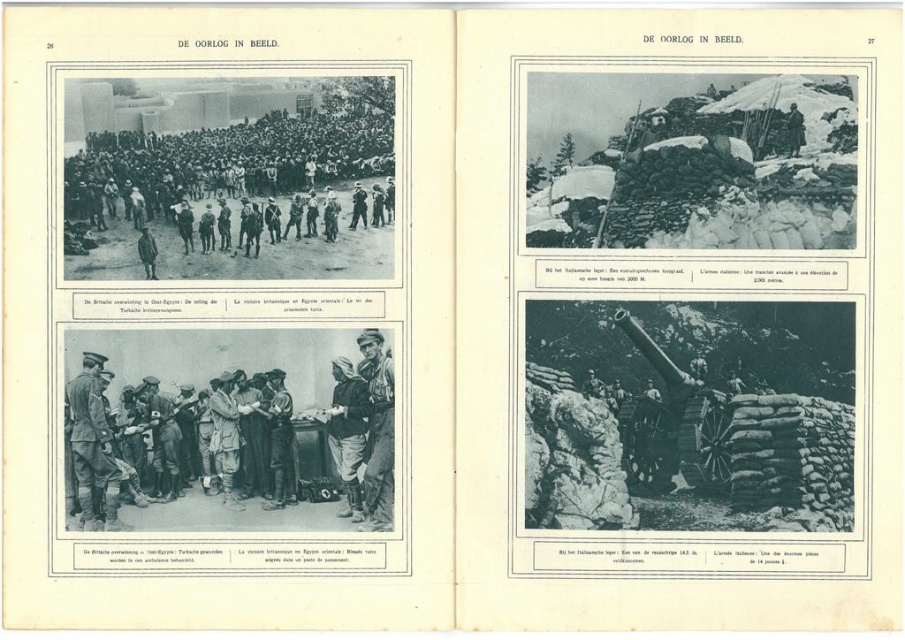
Is camouflage fabric soldier at center below camouflage fabric uniform at center?

Incorrect, camouflage fabric soldier at center is not positioned below camouflage fabric uniform at center.

Describe the element at coordinates (377, 429) in the screenshot. This screenshot has height=640, width=905. I see `camouflage fabric soldier at center` at that location.

Is point (386, 371) in front of point (351, 518)?

That is False.

Image resolution: width=905 pixels, height=640 pixels. I want to click on camouflage fabric soldier at center, so click(377, 429).

Does uniformed officer at center have a lesser height compared to camouflage fabric uniform at center?

Incorrect, uniformed officer at center's height does not fall short of camouflage fabric uniform at center's.

Which is above, uniformed officer at center or camouflage fabric uniform at center?

camouflage fabric uniform at center

Who is more forward, [99,451] or [340,465]?

Point [340,465] is in front.

Where is `uniformed officer at center`? This screenshot has height=640, width=905. uniformed officer at center is located at coordinates (92, 448).

Can you confirm if uniformed officer at center is smaller than camouflage fabric soldier at center?

No.

Is uniformed officer at center in front of camouflage fabric soldier at center?

No, uniformed officer at center is behind camouflage fabric soldier at center.

Between point (87, 371) and point (391, 474), which one is positioned behind?

The point (87, 371) is more distant.

Where is `uniformed officer at center`? This screenshot has width=905, height=640. uniformed officer at center is located at coordinates (92, 448).